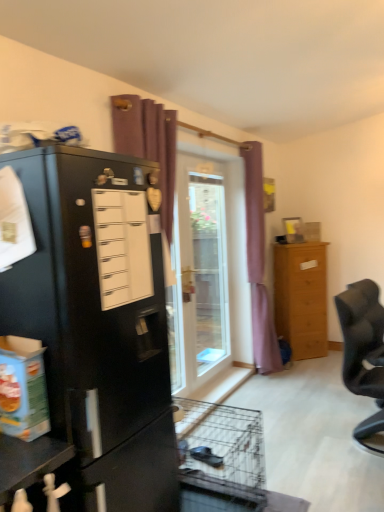
Question: Considering the positions of black fabric chair at right and black matte refrigerator at left in the image, is black fabric chair at right taller or shorter than black matte refrigerator at left?

Choices:
 (A) tall
 (B) short

Answer: (B)

Question: Is black fabric chair at right in front of or behind black matte refrigerator at left in the image?

Choices:
 (A) front
 (B) behind

Answer: (B)

Question: Which of these objects is positioned closest to the purple fabric curtain at upper center, which is the first curtain from left to right?

Choices:
 (A) purple fabric curtain at center, marked as the second curtain in a left-to-right arrangement
 (B) transparent glass door at center
 (C) light brown wooden chest of drawers at right
 (D) black matte refrigerator at left
 (E) white matte drawer at left

Answer: (E)

Question: Considering the real-world distances, which object is farthest from the transparent glass door at center?

Choices:
 (A) white matte drawer at left
 (B) black fabric chair at right
 (C) light brown wooden chest of drawers at right
 (D) purple fabric curtain at center, marked as the second curtain in a left-to-right arrangement
 (E) black matte refrigerator at left

Answer: (A)